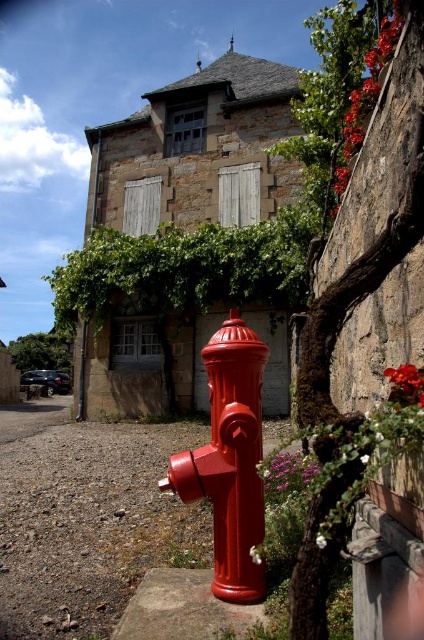
Does smooth stone wall at upper right have a greater width compared to smooth glossy petal at center right?

Yes, smooth stone wall at upper right is wider than smooth glossy petal at center right.

Which is behind, point (356, 93) or point (390, 376)?

The point (356, 93) is behind.

The width and height of the screenshot is (424, 640). What are the coordinates of `smooth stone wall at upper right` in the screenshot? It's located at (367, 96).

Which is in front, point (261, 509) or point (415, 387)?

Point (415, 387) is more forward.

Is point (261, 376) positioned in front of point (420, 394)?

No.

Between point (243, 397) and point (390, 400), which one is positioned behind?

The point (243, 397) is more distant.

Where is `glossy red fire hydrant at center`? This screenshot has height=640, width=424. glossy red fire hydrant at center is located at coordinates (229, 460).

Can you confirm if smooth stone wall at upper right is positioned to the left of purple matte flower at lower center?

In fact, smooth stone wall at upper right is to the right of purple matte flower at lower center.

In the scene shown: Can you confirm if smooth stone wall at upper right is taller than purple matte flower at lower center?

Correct, smooth stone wall at upper right is much taller as purple matte flower at lower center.

Between point (392, 13) and point (290, 480), which one is positioned in front?

Point (290, 480) is in front.

Identify the location of smooth stone wall at upper right. (367, 96).